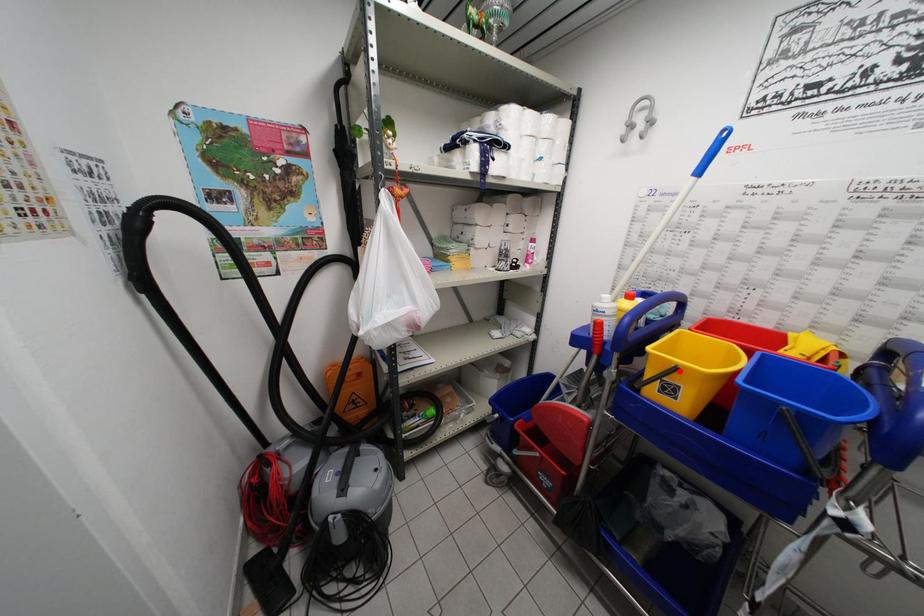
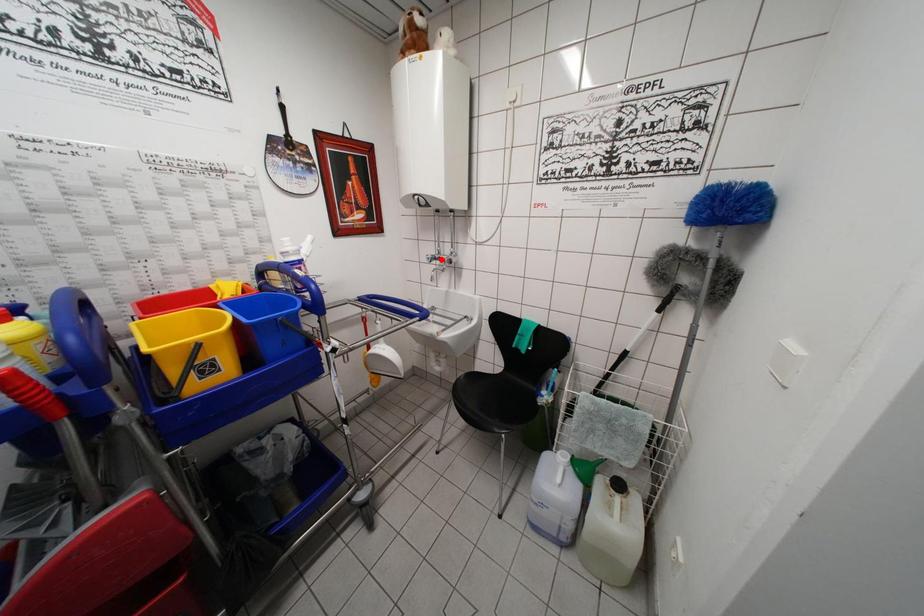
I am providing you with two images of the same scene from different viewpoints. A red point is marked on the first image and another point is marked on the second image. Is the red point in image1 aligned with the point shown in image2?

No